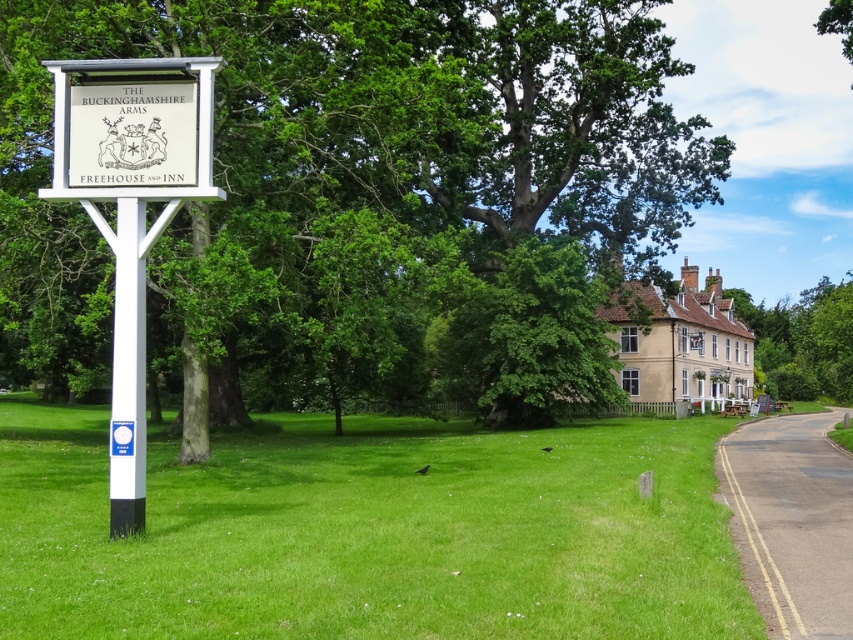
You are a painter setting up your easel to capture the scene. You want to ensure that both the green leafy tree at upper center and the white wooden sign at upper left are visible in your painting. Which object should you position closer to the edge of your canvas to avoid overcrowding?

The white wooden sign at upper left should be positioned closer to the edge of your canvas because it is narrower than the green leafy tree at upper center, which might be wider and requires more space to capture its full width.

You are a painter who wants to paint both the white wooden sign at upper left and the white plastic pole at left. Since you need to know which one is taller to decide the size of your canvas, can you tell me which object is taller?

The white wooden sign at upper left has a greater height compared to the white plastic pole at left, so the white wooden sign at upper left is taller.